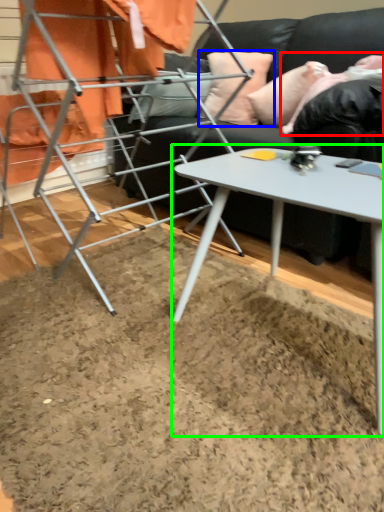
Question: Considering the real-world distances, which object is closest to person (highlighted by a red box)? pillow (highlighted by a blue box) or table (highlighted by a green box).

Choices:
 (A) pillow
 (B) table

Answer: (A)